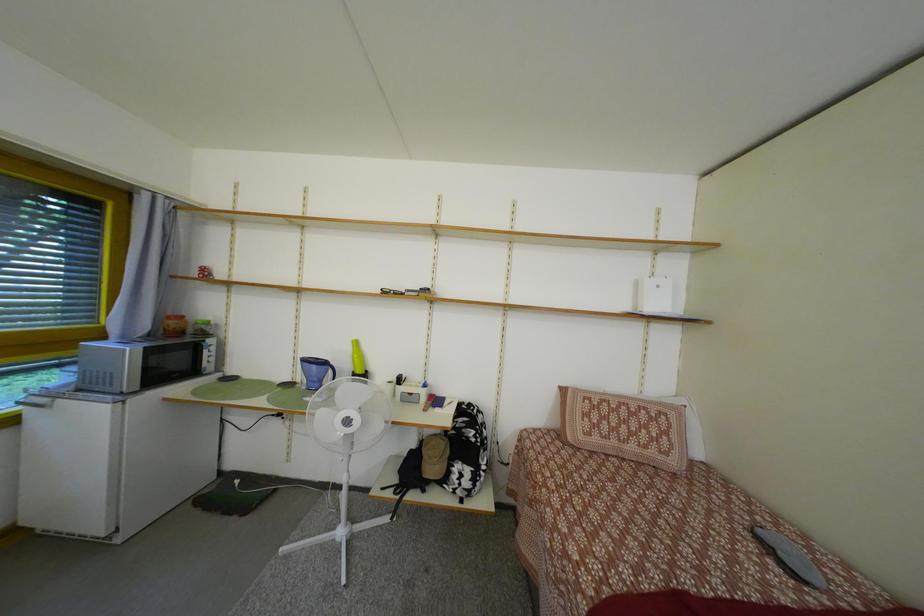
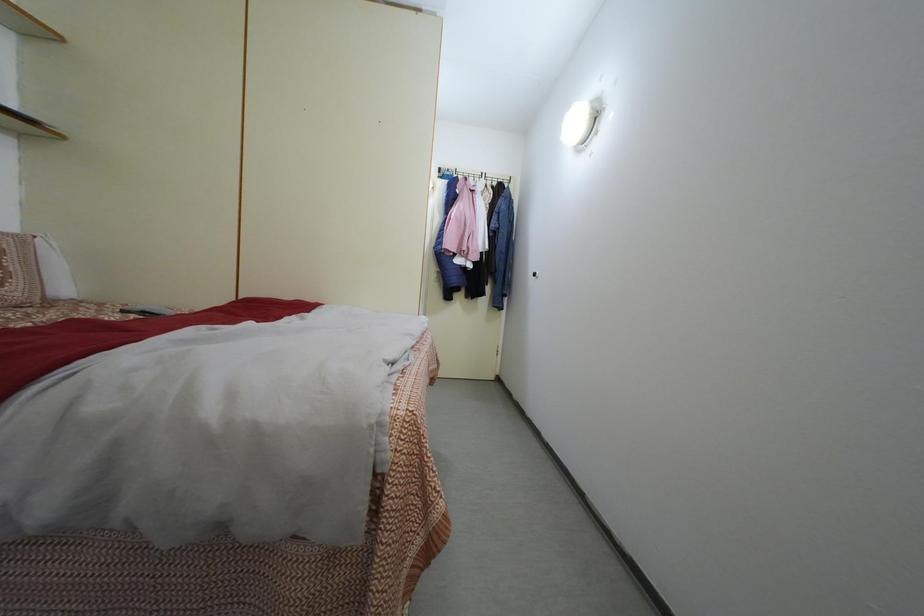
Question: The camera is either moving clockwise (left) or counter-clockwise (right) around the object. The first image is from the beginning of the video and the second image is from the end. Is the camera moving left or right when shooting the video?

Choices:
 (A) Left
 (B) Right

Answer: (A)